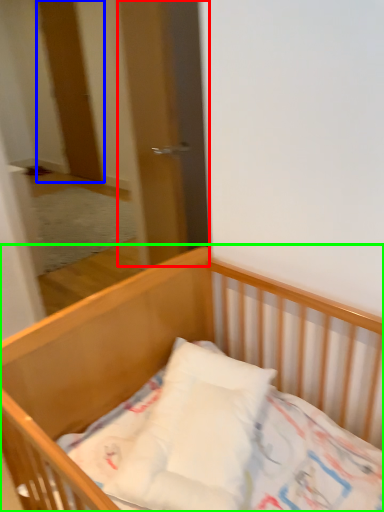
Question: Estimate the real-world distances between objects in this image. Which object is farther from screen door (highlighted by a red box), door (highlighted by a blue box) or bed (highlighted by a green box)?

Choices:
 (A) door
 (B) bed

Answer: (A)